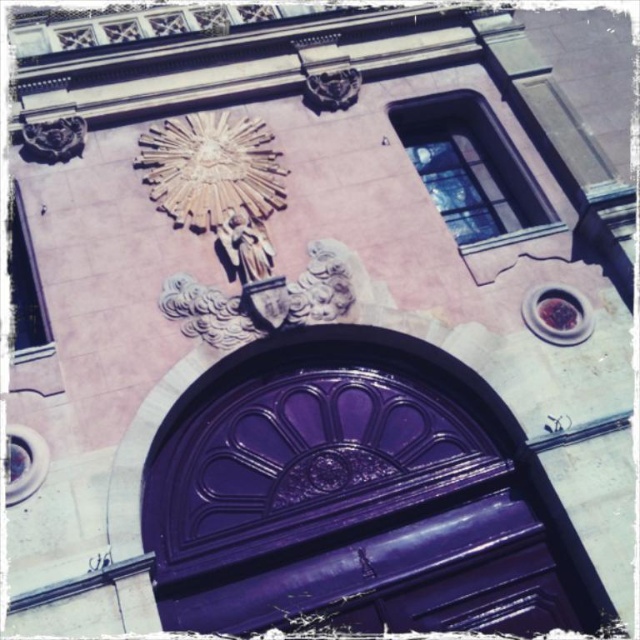
You are an architect assessing the symmetry of the building facade. Given the gold metallic clock at upper center and the white stone statue at center, which object has a greater width?

The gold metallic clock at upper center has a greater width than the white stone statue at center, as stated in the description.

You are an architect planning to install a new door in a similar style. Given the glossy purple door at center and the white stone statue at center in the image, which object is wider and by how much?

The glossy purple door at center is wider than the white stone statue at center, but the exact difference in width isn not specified in the provided description.